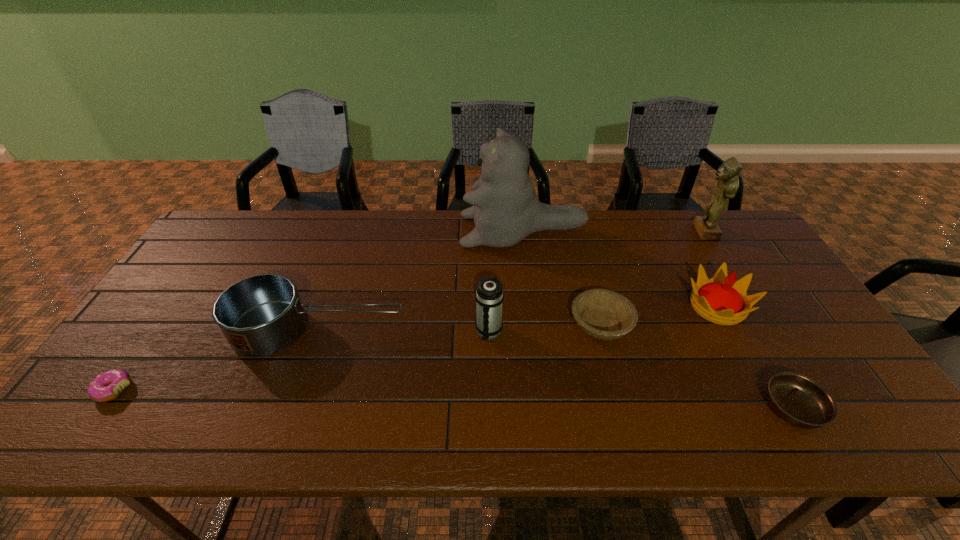
The width and height of the screenshot is (960, 540). I want to click on free point between the second shortest object and the fourth shortest object, so click(556, 369).

The height and width of the screenshot is (540, 960). Identify the location of free space between the soup bowl and the third tallest object. (640, 370).

Where is `free space between the fourth shortest object and the thermos bottle`? free space between the fourth shortest object and the thermos bottle is located at coordinates (404, 331).

Identify the location of free spot between the second object from left to right and the tallest object. (421, 280).

This screenshot has height=540, width=960. Find the location of `free space between the thermos bottle and the second tallest object`. free space between the thermos bottle and the second tallest object is located at coordinates (596, 282).

Choose which object is the fifth nearest neighbor to the seventh shortest object. Please provide its 2D coordinates. Your answer should be formatted as a tuple, i.e. [(x, y)], where the tuple contains the x and y coordinates of a point satisfying the conditions above.

[(489, 296)]

Point out which object is positioned as the fourth nearest to the leftmost object. Please provide its 2D coordinates. Your answer should be formatted as a tuple, i.e. [(x, y)], where the tuple contains the x and y coordinates of a point satisfying the conditions above.

[(604, 314)]

Image resolution: width=960 pixels, height=540 pixels. In order to click on free space that satisfies the following two spatial constraints: 1. on the face of the soup bowl; 2. on the right side of the cat in this screenshot , I will do `click(544, 408)`.

The image size is (960, 540). I want to click on free space that satisfies the following two spatial constraints: 1. on the back side of the fourth tallest object; 2. on the face of the tallest object, so click(x=677, y=231).